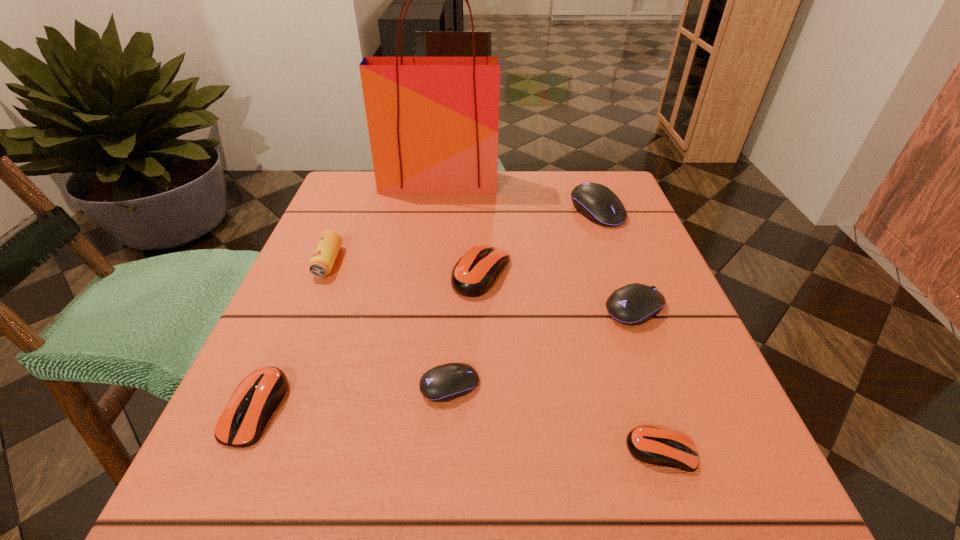
At what (x,y) coordinates should I click in order to perform the action: click on vacant space located on the right of the smallest black computer mouse. Please return your answer as a coordinate pair (x, y). The height and width of the screenshot is (540, 960). Looking at the image, I should click on (514, 386).

Find the location of a particular element. This screenshot has width=960, height=540. blank space located 0.120m on the left of the rightmost orange computer mouse is located at coordinates (535, 451).

Identify the location of shopping bag that is positioned at the far edge. Image resolution: width=960 pixels, height=540 pixels. (433, 122).

Where is `computer mouse present at the far edge`? This screenshot has height=540, width=960. computer mouse present at the far edge is located at coordinates (596, 202).

Identify the location of object present at the near edge. (652, 445).

At what (x,y) coordinates should I click in order to perform the action: click on shopping bag present at the left edge. Please return your answer as a coordinate pair (x, y). The width and height of the screenshot is (960, 540). Looking at the image, I should click on (x=433, y=122).

Find the location of a particular element. Image resolution: width=960 pixels, height=540 pixels. beer can present at the left edge is located at coordinates (321, 263).

What are the coordinates of `computer mouse located at the left edge` in the screenshot? It's located at (255, 399).

Where is `object present at the far left corner`? The width and height of the screenshot is (960, 540). object present at the far left corner is located at coordinates (433, 122).

This screenshot has width=960, height=540. I want to click on object at the far right corner, so click(596, 202).